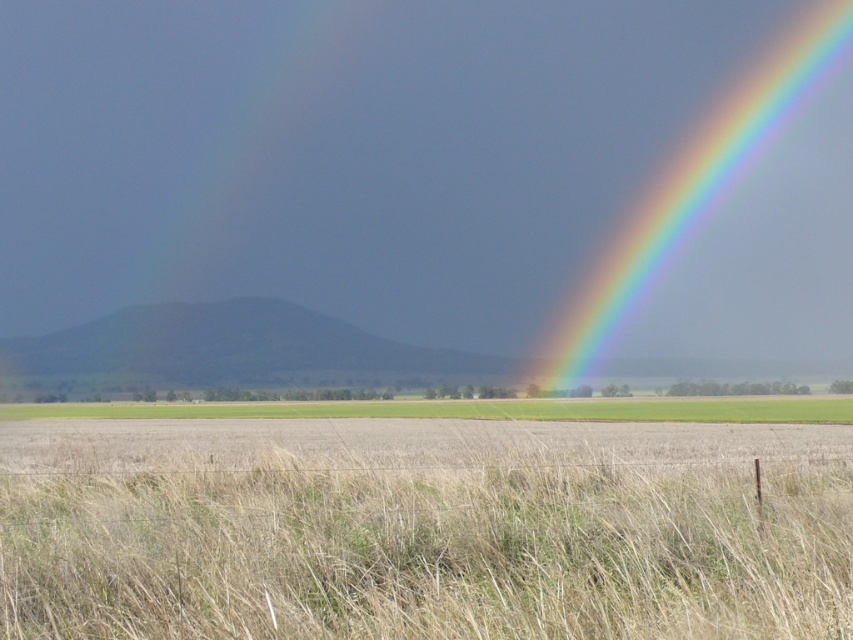
Image resolution: width=853 pixels, height=640 pixels. Identify the location of rainbow at upper right. (692, 195).

Is point (590, 285) closer to camera compared to point (846, 417)?

No.

This screenshot has height=640, width=853. Find the location of `rainbow at upper right`. rainbow at upper right is located at coordinates (692, 195).

Does dry grass at lower center come in front of green grassland at center?

Yes, it is in front of green grassland at center.

Can you confirm if dry grass at lower center is positioned below green grassland at center?

Actually, dry grass at lower center is above green grassland at center.

Where is `dry grass at lower center`? Image resolution: width=853 pixels, height=640 pixels. dry grass at lower center is located at coordinates pyautogui.click(x=422, y=529).

Can you confirm if dry grass at lower center is smaller than rainbow at upper right?

Yes, dry grass at lower center is smaller than rainbow at upper right.

Does dry grass at lower center have a larger size compared to rainbow at upper right?

Incorrect, dry grass at lower center is not larger than rainbow at upper right.

Does point (701, 468) come behind point (833, 26)?

That is False.

You are a GUI agent. You are given a task and a screenshot of the screen. Output one action in this format:
    pyautogui.click(x=<x>, y=<y>)
    Task: Click on the dry grass at lower center
    The width and height of the screenshot is (853, 640).
    Given the screenshot: What is the action you would take?
    pyautogui.click(x=422, y=529)